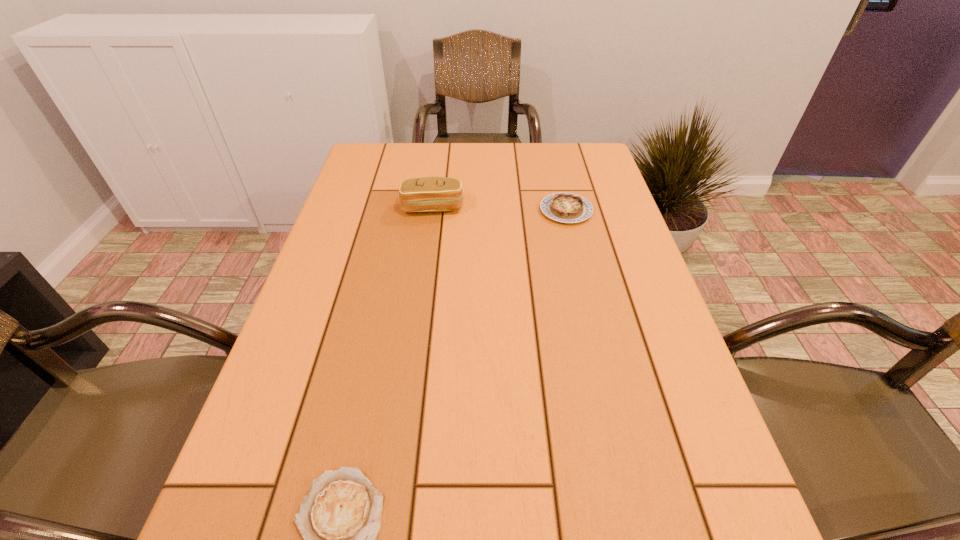
Where is `clutch bag`? The image size is (960, 540). clutch bag is located at coordinates (426, 194).

The image size is (960, 540). In order to click on the rightmost object in this screenshot , I will do `click(564, 207)`.

What are the coordinates of `the farther quiche` in the screenshot? It's located at (564, 207).

The image size is (960, 540). Find the location of `vacant position located 0.360m on the zipper side of the tallest object`. vacant position located 0.360m on the zipper side of the tallest object is located at coordinates (419, 321).

In order to click on vacant area located on the front of the taller quiche in this screenshot , I will do `click(592, 322)`.

Image resolution: width=960 pixels, height=540 pixels. I want to click on object present at the right edge, so click(x=564, y=207).

You are a GUI agent. You are given a task and a screenshot of the screen. Output one action in this format:
    pyautogui.click(x=<x>, y=<y>)
    Task: Click on the vacant position at the far edge of the desktop
    Image resolution: width=960 pixels, height=540 pixels.
    Given the screenshot: What is the action you would take?
    pyautogui.click(x=438, y=150)

Find the location of a particular element. free space at the left edge is located at coordinates (263, 539).

In the image, there is a desktop. In order to click on free space at the right edge in this screenshot , I will do `click(570, 234)`.

Locate an element on the screen. This screenshot has width=960, height=540. blank space at the far left corner is located at coordinates (382, 180).